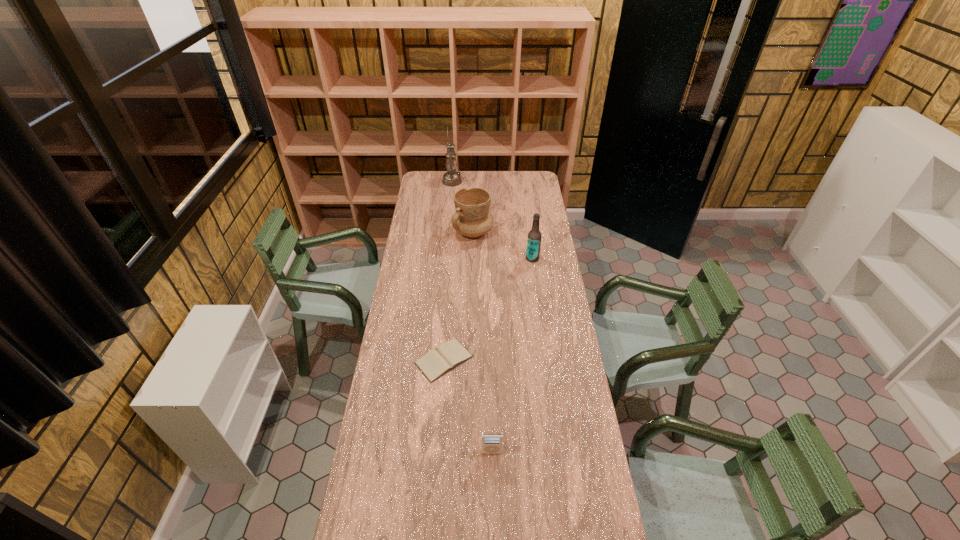
Locate an element on the screen. This screenshot has width=960, height=540. free space located 0.070m on the label of the third farthest object is located at coordinates click(x=513, y=258).

The width and height of the screenshot is (960, 540). I want to click on free space located on the label of the third farthest object, so click(488, 258).

The image size is (960, 540). I want to click on free space located on the label of the third farthest object, so coord(497,258).

The width and height of the screenshot is (960, 540). Identify the location of free location located on the front of the fourth nearest object. (471, 296).

I want to click on vacant space situated on the front-facing side of the second shortest object, so click(492, 475).

Find the location of a particular element. The height and width of the screenshot is (540, 960). free space located on the back of the second nearest object is located at coordinates (447, 309).

Locate an element on the screen. Image resolution: width=960 pixels, height=540 pixels. object at the far edge is located at coordinates (451, 178).

Identify the location of oil lamp that is at the left edge. The image size is (960, 540). (451, 178).

Where is `Bible that is at the left edge`? This screenshot has width=960, height=540. Bible that is at the left edge is located at coordinates (437, 362).

I want to click on object that is at the right edge, so click(534, 236).